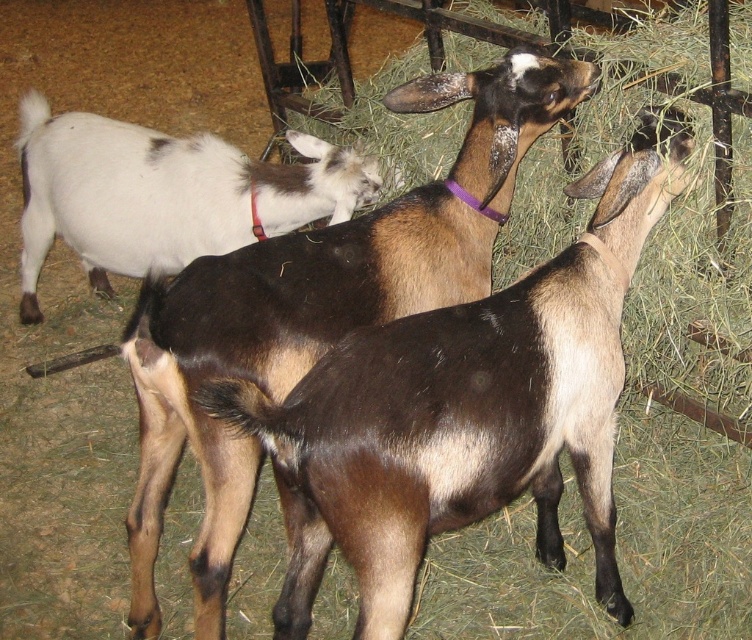
Question: Where is brown fuzzy goat at center located in relation to white matte goat at upper left in the image?

Choices:
 (A) above
 (B) below

Answer: (B)

Question: Which object appears farthest from the camera in this image?

Choices:
 (A) brown fuzzy goat at center
 (B) white matte goat at upper left

Answer: (B)

Question: Can you confirm if brown fuzzy goat at center is positioned above white matte goat at upper left?

Choices:
 (A) no
 (B) yes

Answer: (A)

Question: Which object is farther from the camera taking this photo?

Choices:
 (A) white matte goat at upper left
 (B) brown fuzzy goat at center

Answer: (A)

Question: Is brown fuzzy goat at center to the left of white matte goat at upper left from the viewer's perspective?

Choices:
 (A) yes
 (B) no

Answer: (B)